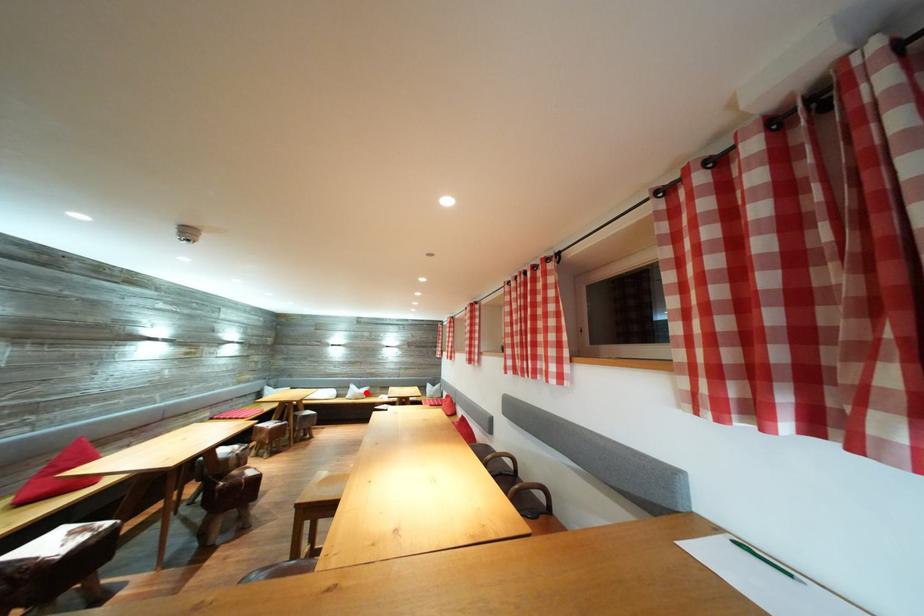
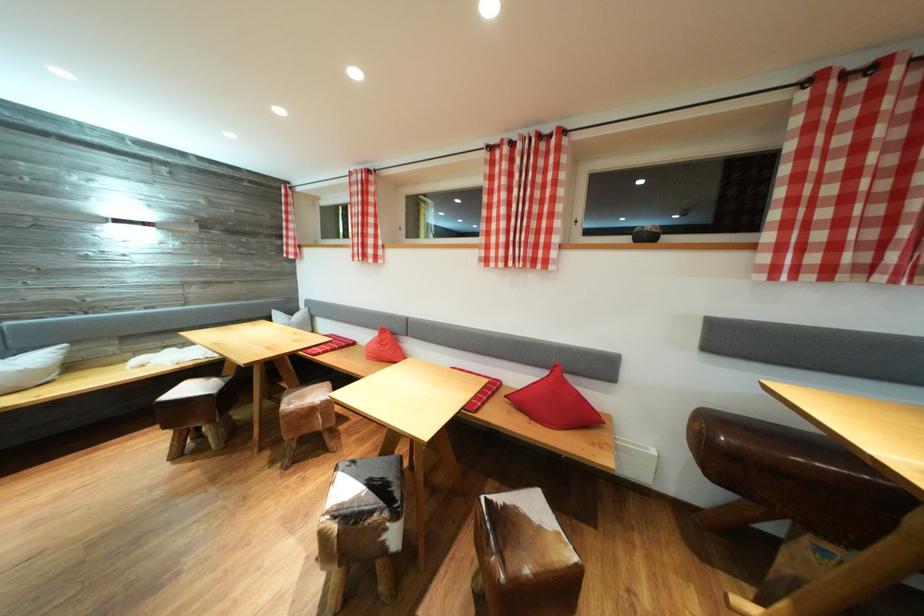
Question: I am providing you with two images of the same scene from different viewpoints. Given a red point in image1, look at the same physical point in image2. Is it:

Choices:
 (A) Closer to the viewpoint
 (B) Farther from the viewpoint

Answer: (A)